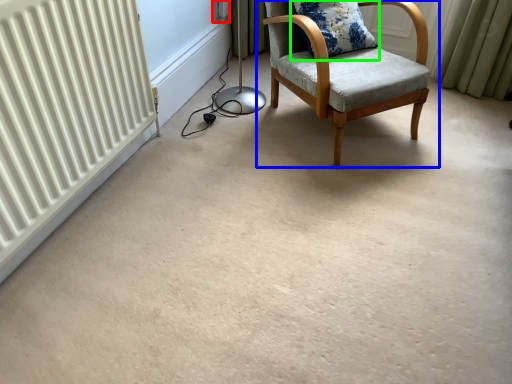
Question: Which object is positioned farthest from electric outlet (highlighted by a red box)? Select from chair (highlighted by a blue box) and pillow (highlighted by a green box).

Choices:
 (A) chair
 (B) pillow

Answer: (A)